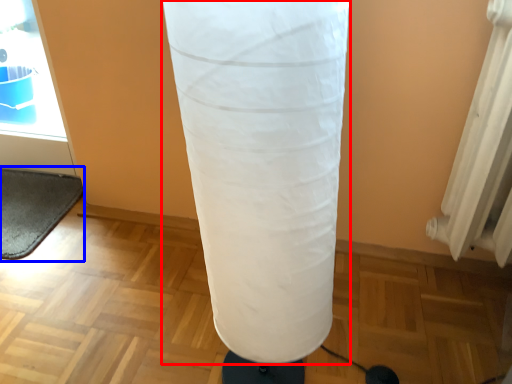
Question: Which point is further to the camera, punching bag (highlighted by a red box) or yoga mat (highlighted by a blue box)?

Choices:
 (A) punching bag
 (B) yoga mat

Answer: (B)